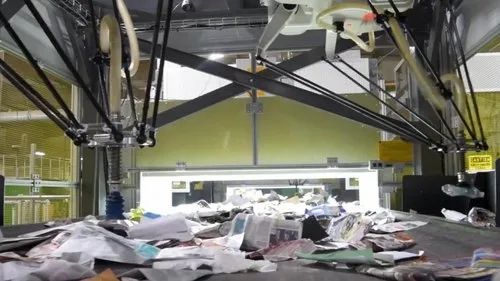
Where is `wires`? The height and width of the screenshot is (281, 500). wires is located at coordinates (382, 92), (377, 97), (295, 79), (463, 56), (456, 57).